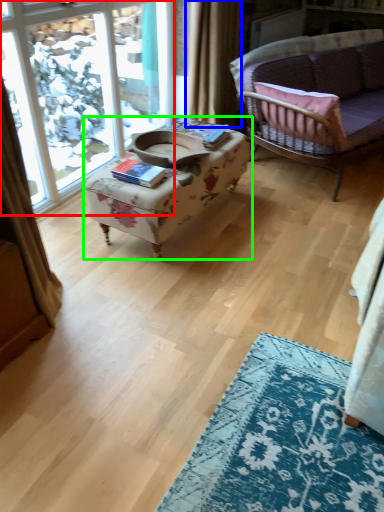
Question: Estimate the real-world distances between objects in this image. Which object is farther from window (highlighted by a red box), curtain (highlighted by a blue box) or table (highlighted by a green box)?

Choices:
 (A) curtain
 (B) table

Answer: (B)